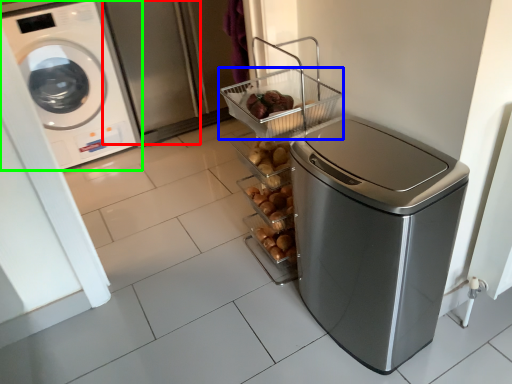
Question: Which is farther away from screen door (highlighted by a red box)? basket (highlighted by a blue box) or washing machine (highlighted by a green box)?

Choices:
 (A) basket
 (B) washing machine

Answer: (A)